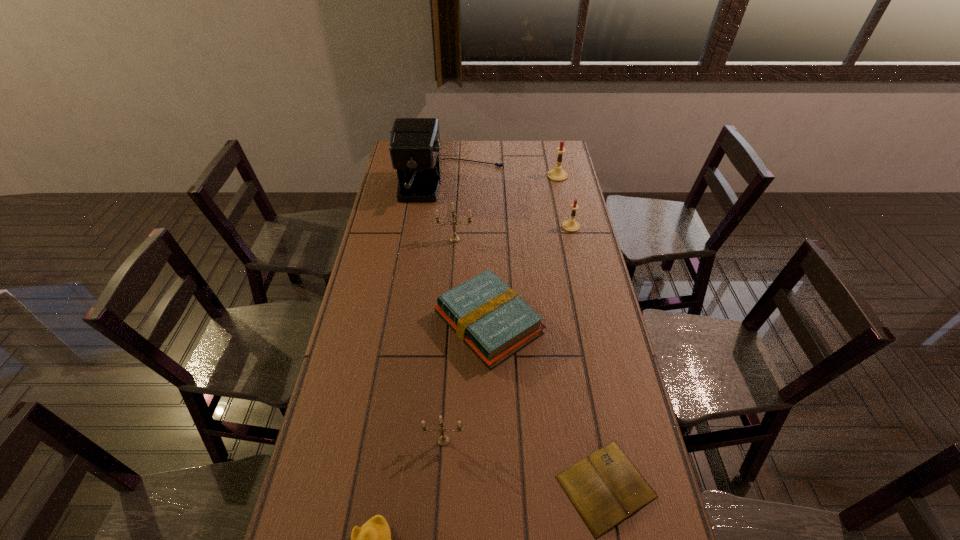
Locate an element on the screen. the fourth nearest object is located at coordinates (488, 316).

Locate an element on the screen. This screenshot has height=540, width=960. hardback book is located at coordinates (488, 316).

Where is `book`? This screenshot has width=960, height=540. book is located at coordinates (606, 488).

The image size is (960, 540). What are the coordinates of `free space located 0.280m on the front-facing side of the coffee maker` in the screenshot? It's located at (445, 257).

Where is `free space located on the front of the bigger red candle`? free space located on the front of the bigger red candle is located at coordinates (566, 217).

Locate an element on the screen. This screenshot has width=960, height=540. vacant space located on the front of the fifth nearest object is located at coordinates (454, 253).

Find the location of a particular element. vacant space located on the front of the sixth nearest object is located at coordinates (575, 244).

At what (x,y) coordinates should I click in order to perform the action: click on vacant area situated 0.140m on the back of the nearest candle. Please return your answer as a coordinate pair (x, y). Image resolution: width=960 pixels, height=540 pixels. Looking at the image, I should click on (446, 388).

Find the location of a particular element. This screenshot has height=540, width=960. free region located on the front of the yellow hardback book is located at coordinates (490, 406).

Where is `free space located on the left of the book`? free space located on the left of the book is located at coordinates (400, 487).